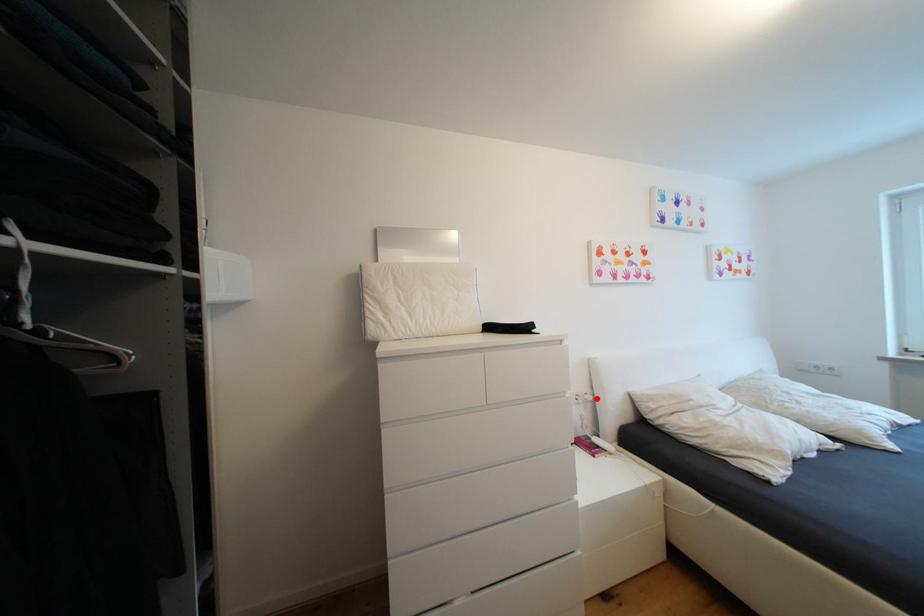
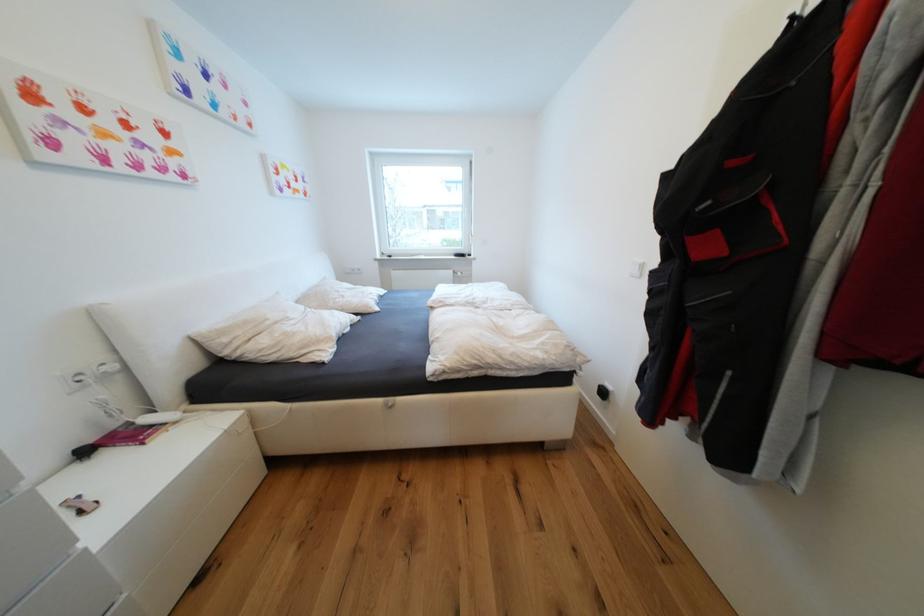
Where in the second image is the point corresponding to the highlighted location from the first image?

(119, 369)